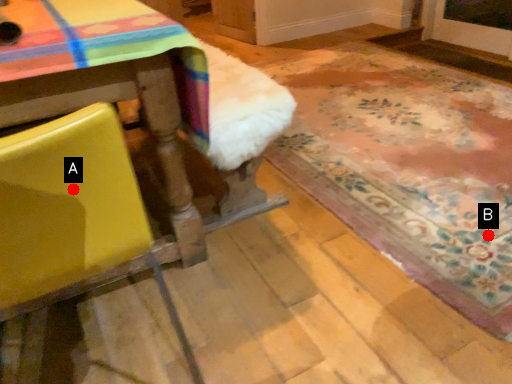
Question: Two points are circled on the image, labeled by A and B beside each circle. Which point appears closest to the camera in this image?

Choices:
 (A) A is closer
 (B) B is closer

Answer: (A)